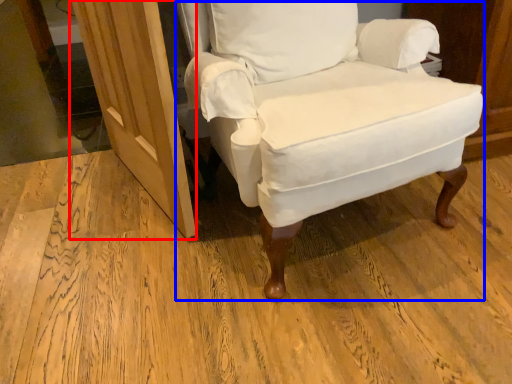
Question: Which object appears farthest to the camera in this image, screen door (highlighted by a red box) or chair (highlighted by a blue box)?

Choices:
 (A) screen door
 (B) chair

Answer: (A)